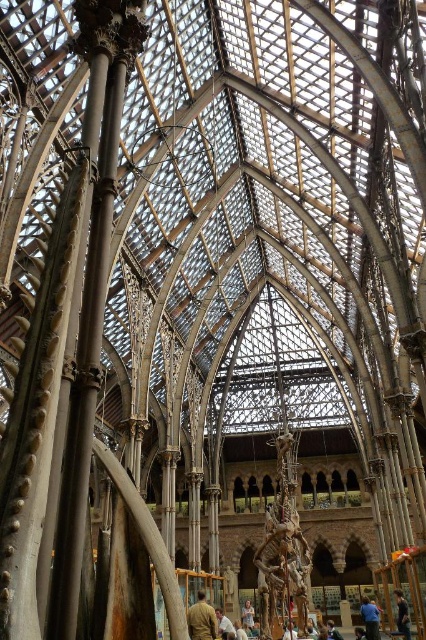
Question: Among these objects, which one is nearest to the camera?

Choices:
 (A) blue fabric shirt at lower right
 (B) light brown leather jacket at lower center

Answer: (B)

Question: Which point is farther from the camera taking this photo?

Choices:
 (A) [x=221, y=624]
 (B) [x=264, y=582]

Answer: (A)

Question: Is brown wooden dinosaur at center below light brown wooden chair at center?

Choices:
 (A) no
 (B) yes

Answer: (A)

Question: Where is brown wooden dinosaur at center located in relation to dark blue jeans at lower right in the image?

Choices:
 (A) below
 (B) above

Answer: (B)

Question: Is blue fabric shirt at lower right behind dark blue jeans at lower right?

Choices:
 (A) yes
 (B) no

Answer: (A)

Question: Which object is closer to the camera taking this photo?

Choices:
 (A) brown wooden dinosaur at center
 (B) light brown leather jacket at center
 (C) light brown wooden chair at center

Answer: (A)